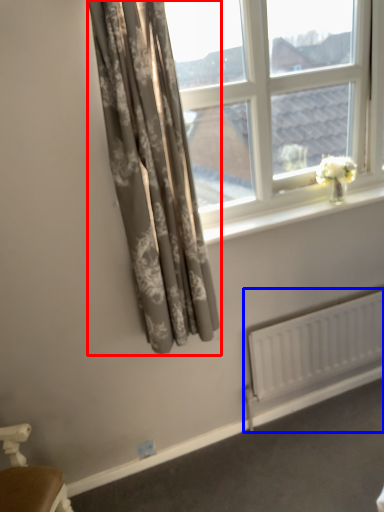
Question: Which object is closer to the camera taking this photo, curtain (highlighted by a red box) or radiator (highlighted by a blue box)?

Choices:
 (A) curtain
 (B) radiator

Answer: (A)